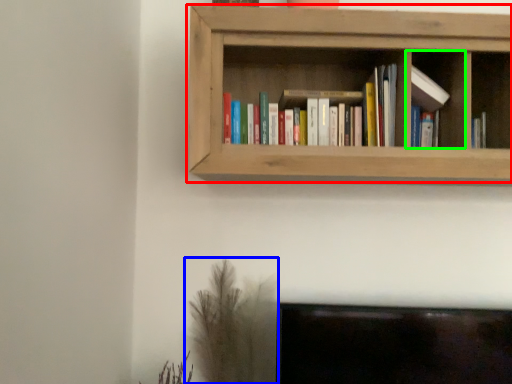
Question: Based on their relative distances, which object is farther from shelf (highlighted by a red box)? Choose from plant (highlighted by a blue box) and cabinet (highlighted by a green box).

Choices:
 (A) plant
 (B) cabinet

Answer: (A)